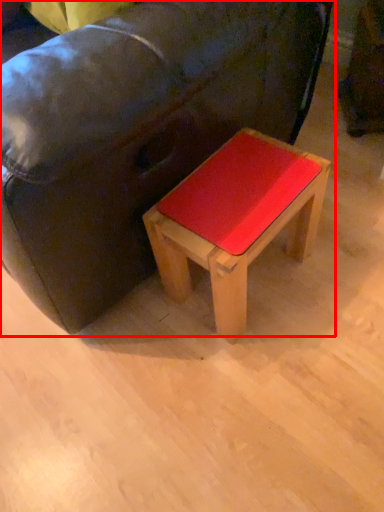
Question: In this image, where is studio couch (annotated by the red box) located relative to stool?

Choices:
 (A) left
 (B) right

Answer: (A)